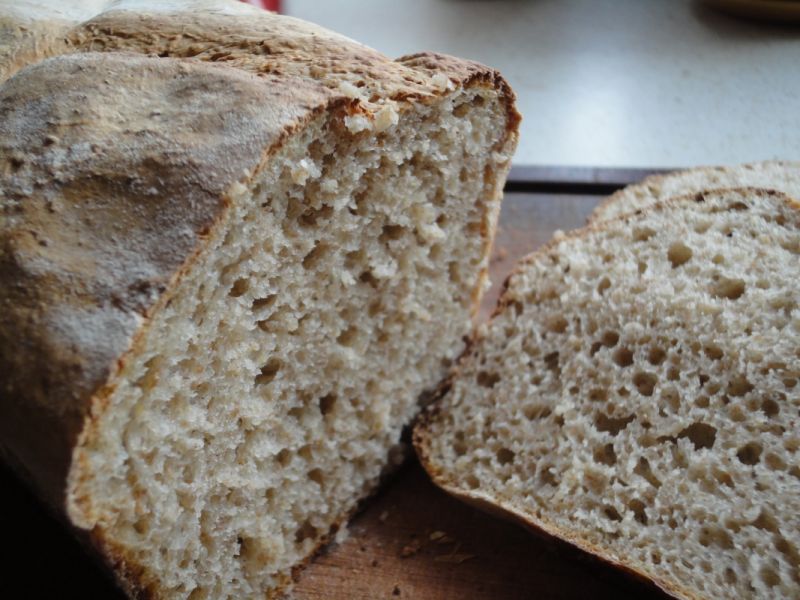
I want to click on table top, so click(x=606, y=40).